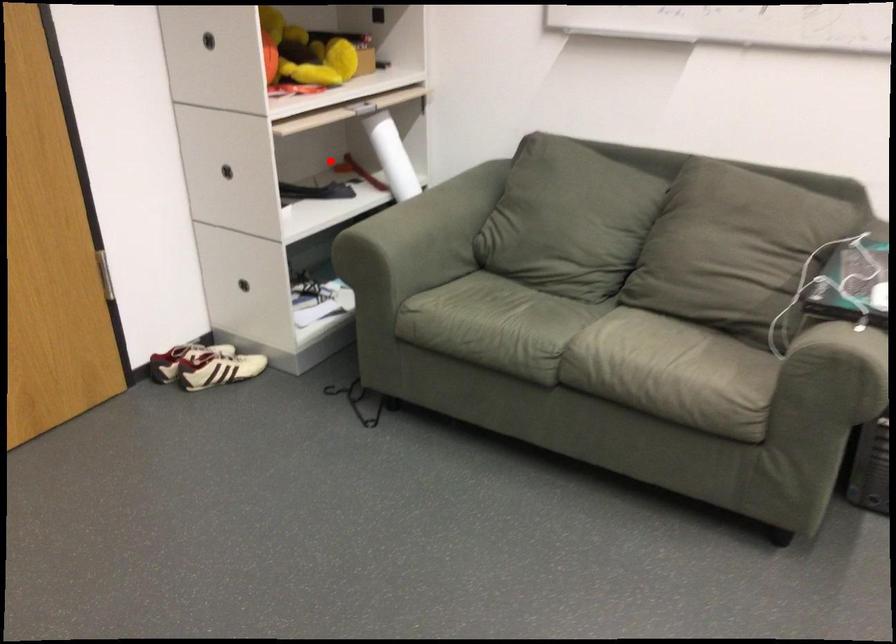
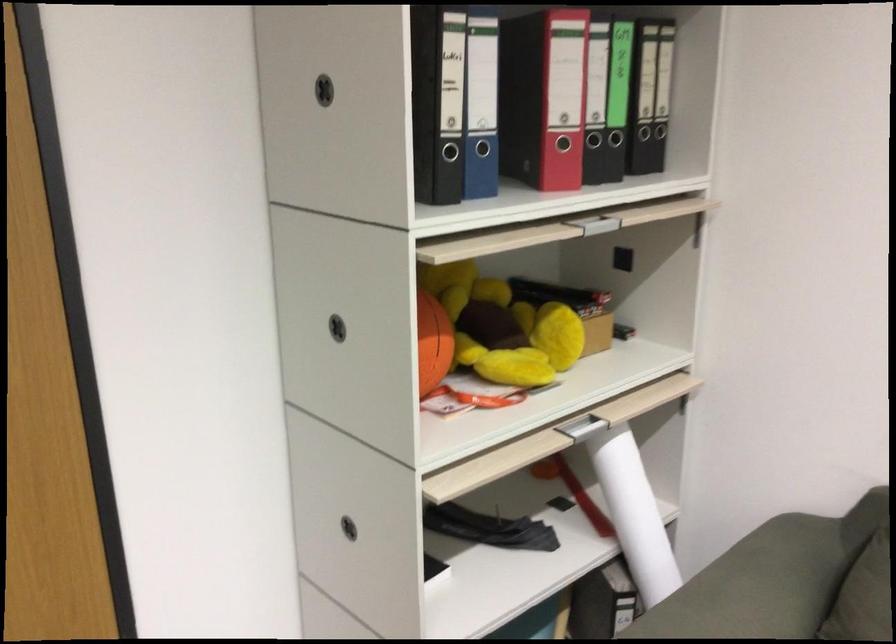
Question: I am providing you with two images of the same scene from different viewpoints. A red point is marked on the first image. At the location where the point appears in image 1, is it still visible in image 2?

Choices:
 (A) Yes
 (B) No

Answer: (B)